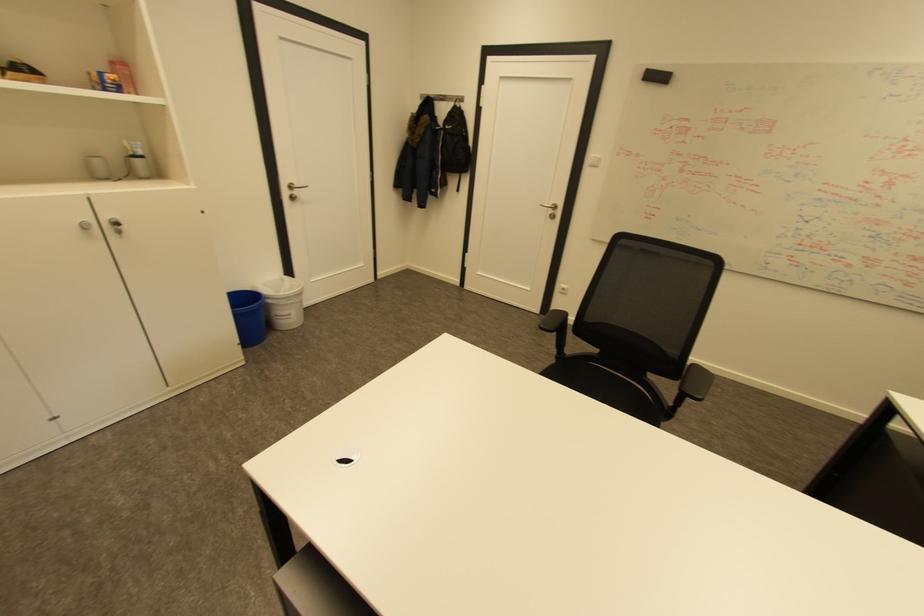
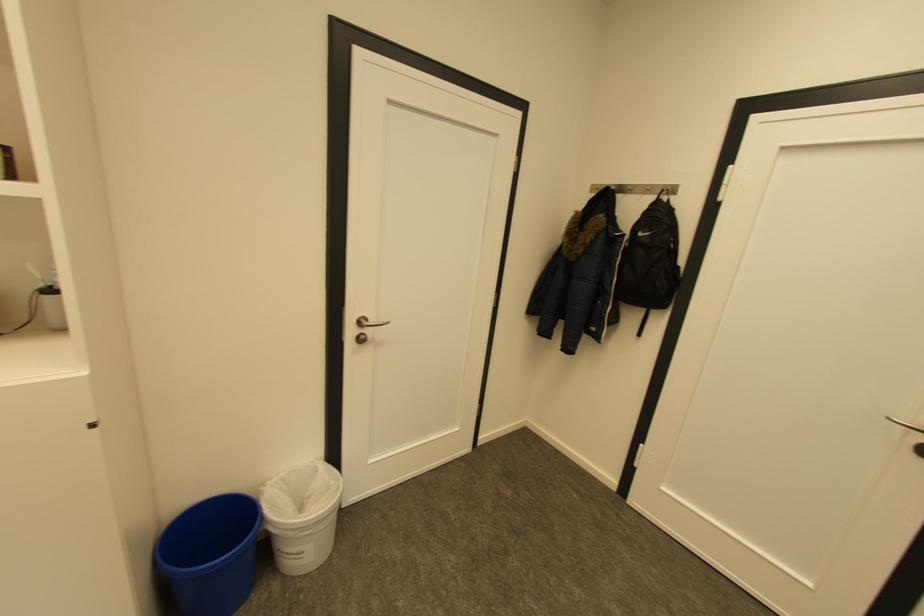
Question: What movement of the cameraman would produce the second image?

Choices:
 (A) Left
 (B) Right
 (C) Forward
 (D) Backward

Answer: (C)